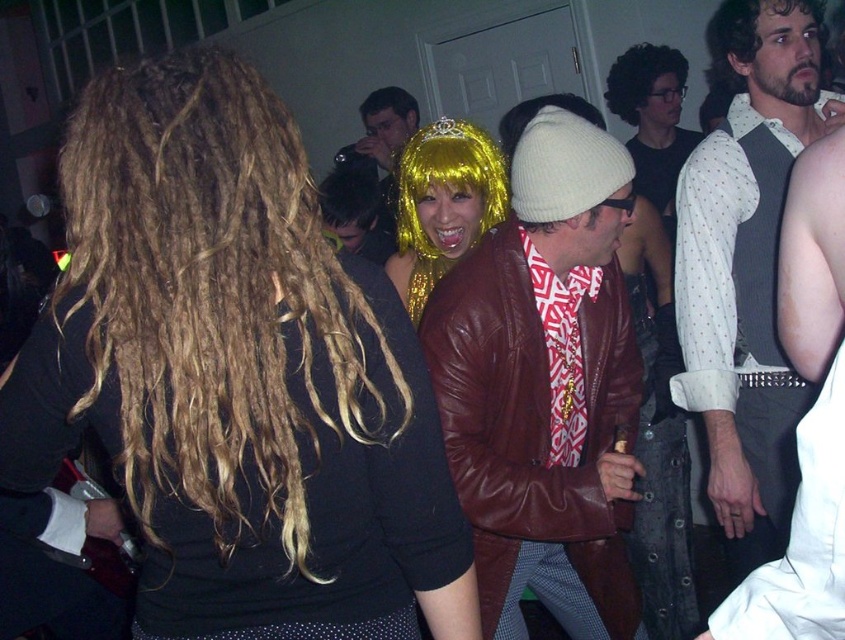
You are at a party and want to take a photo of the leather jacket at center and the sparkly gold wig at center. Which object should you focus on first to ensure both are in the frame?

You should focus on the leather jacket at center first because it is closer to the viewer than the sparkly gold wig at center, ensuring both are in the frame.

You are at a party and want to take a photo of the leather jacket at center and the golden shiny wig at center. Which object should you focus on first if you want to capture both in the same frame without moving the camera?

You should focus on the golden shiny wig at center first because it is above the leather jacket at center, so adjusting focus to the higher object ensures both are in the frame.

You are at a party and need to decide which item to take first from the center of the room. The leather jacket at center is worn by someone, and the golden shiny wig at center is part of a costume. Based on their sizes, which one is easier to grab quickly?

The leather jacket at center is larger in size than the golden shiny wig at center, so it would be easier to grab quickly due to its bigger size.